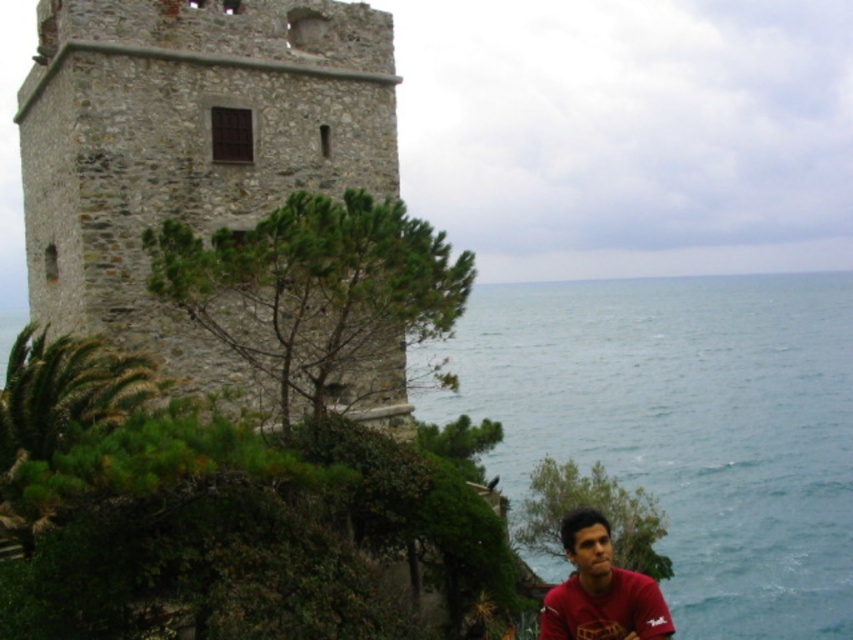
Which is in front, point (711, 332) or point (265, 129)?

Point (265, 129) is more forward.

Based on the photo, who is lower down, blue water at lower right or stone tower at left?

blue water at lower right

Is point (521, 468) farther from camera compared to point (79, 51)?

Yes, it is.

Where is `blue water at lower right`? blue water at lower right is located at coordinates (686, 426).

Measure the distance from stone tower at left to matte red shirt at lower right.

stone tower at left and matte red shirt at lower right are 76.07 feet apart from each other.

Can you confirm if stone tower at left is positioned to the left of matte red shirt at lower right?

Yes, stone tower at left is to the left of matte red shirt at lower right.

Find the location of a particular element. This screenshot has height=640, width=853. stone tower at left is located at coordinates (187, 145).

Which is more to the right, blue water at lower right or matte red shirt at lower right?

blue water at lower right

Is blue water at lower right positioned before matte red shirt at lower right?

That is False.

Which is behind, point (711, 518) or point (589, 552)?

Point (711, 518)

Where is `blue water at lower right`? The image size is (853, 640). blue water at lower right is located at coordinates pos(686,426).